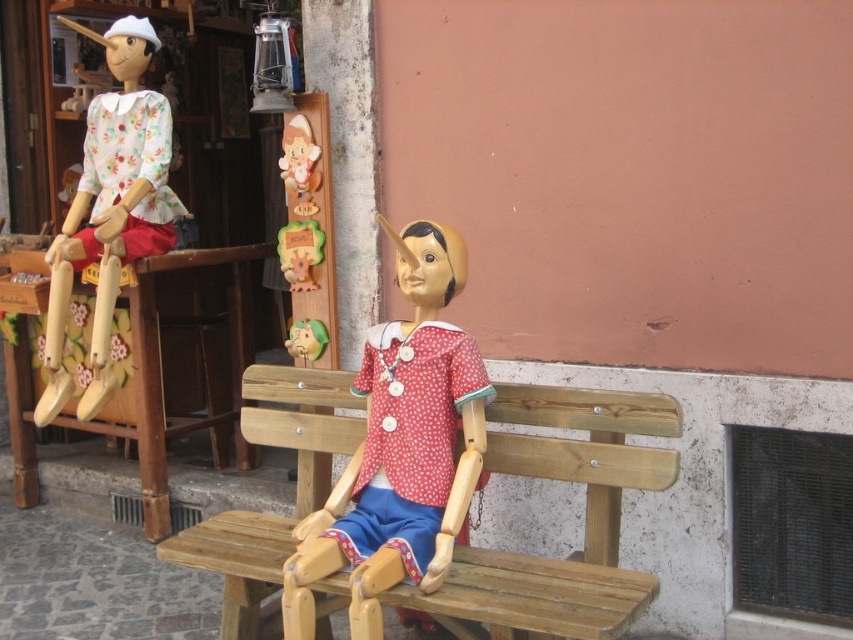
You are a toy store employee who needs to place a new shelf that is 40 inches long between the wooden bench at center and the matte green wooden toy at center. Based on the current spacing between them, will the shelf fit?

The wooden bench at center is 38.40 inches from the matte green wooden toy at center. Since the shelf is 40 inches long, it will not fit between them as the distance is shorter than the shelf length.

You are a visitor standing in front of the Pinocchio figurines. You see the wooden bench at center and the wooden toy at center. Which object is closer to you?

The wooden bench at center is closer to the viewer than the wooden toy at center.